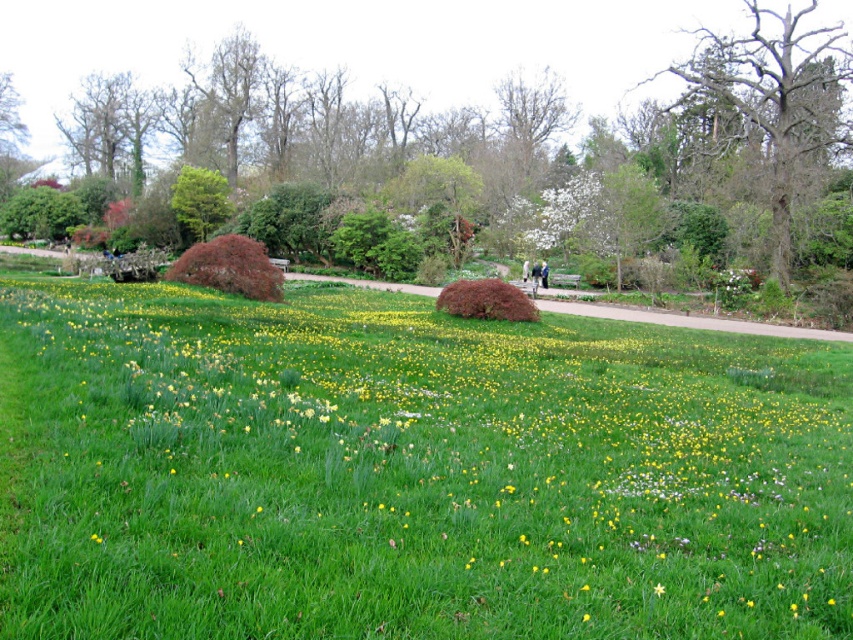
You are planning to walk along the grassy path at center in the park. You notice a smooth bark tree at upper center nearby. Which one is taller between the two?

The smooth bark tree at upper center is taller than the grassy path at center.

You are a gardener who needs to water both the green leafy bush at left and the burgundy matte bush at center. If your watering can holds enough water for 50 meters of travel, can you water both bushes without refilling?

The green leafy bush at left and the burgundy matte bush at center are 60.17 meters apart from each other. Since the distance exceeds the 50 meters your watering can can cover, you will need to refill before watering both bushes.